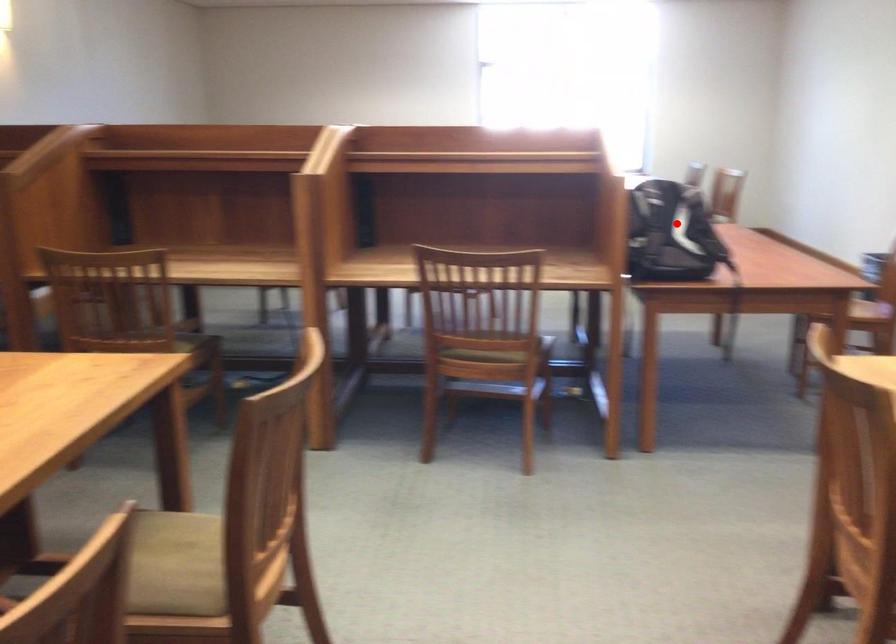
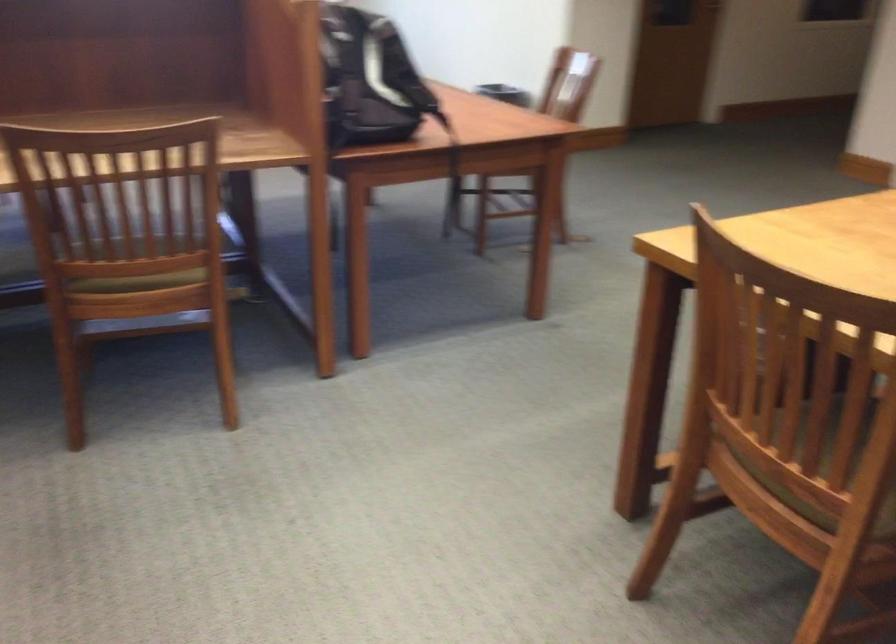
The point at the highlighted location is marked in the first image. Where is the corresponding point in the second image?

(371, 80)